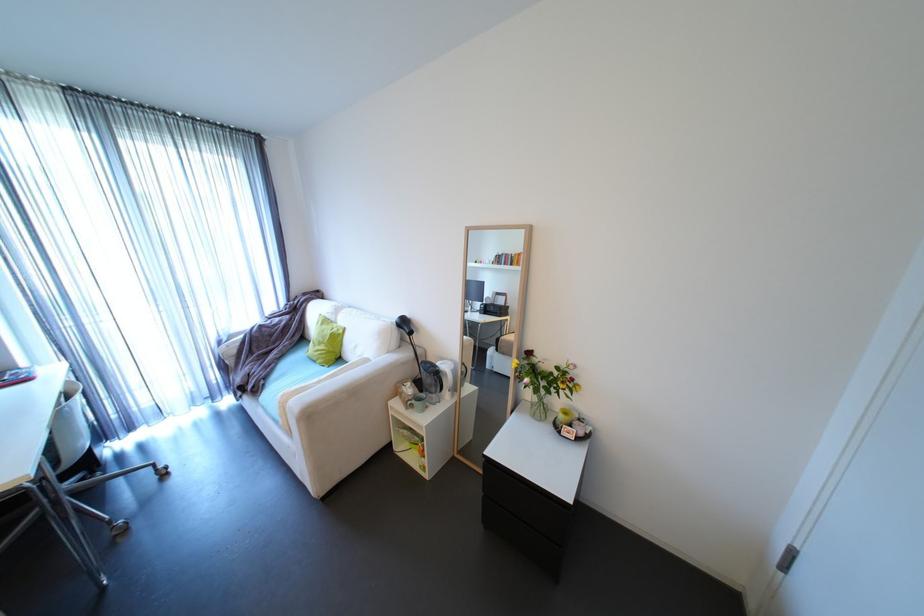
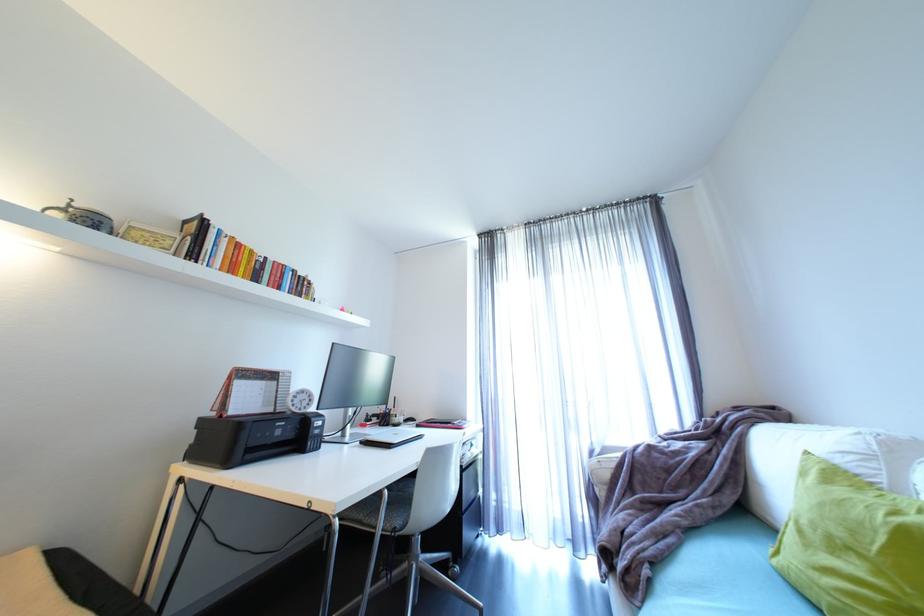
Where in the second image is the point corresponding to the point at 333,346 from the first image?

(885, 573)